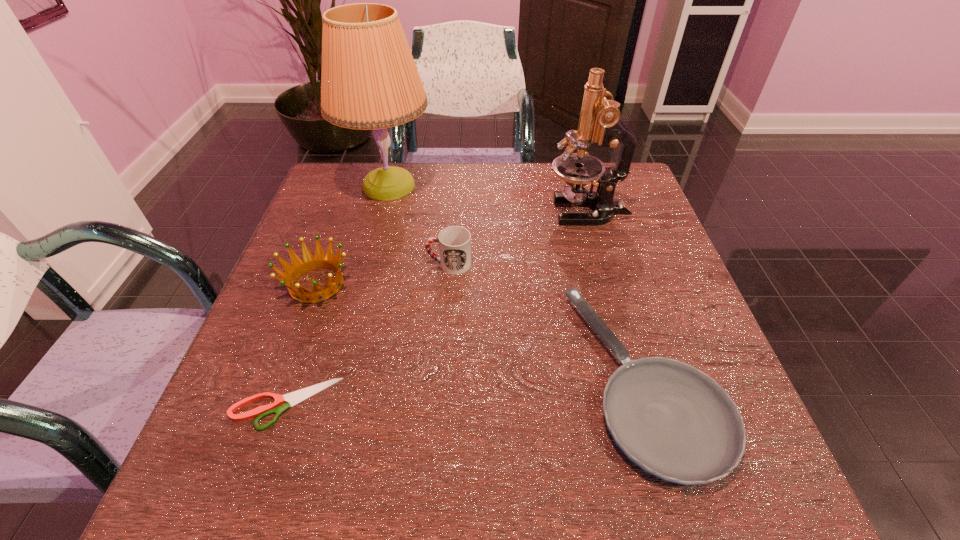
Where is `free spot between the scissors and the cup`? The image size is (960, 540). free spot between the scissors and the cup is located at coordinates (367, 334).

At what (x,y) coordinates should I click in order to perform the action: click on free spot between the lamp and the crown. Please return your answer as a coordinate pair (x, y). This screenshot has height=540, width=960. Looking at the image, I should click on (352, 235).

Find the location of `the closest object relative to the microscope`. the closest object relative to the microscope is located at coordinates (454, 242).

Where is `object that can be found as the closest to the microscope`? This screenshot has height=540, width=960. object that can be found as the closest to the microscope is located at coordinates (454, 242).

Locate an element on the screen. The height and width of the screenshot is (540, 960). blank space that satisfies the following two spatial constraints: 1. at the eyepiece of the second tallest object; 2. on the left side of the second shortest object is located at coordinates (636, 378).

Where is `vacant space that satisfies the following two spatial constraints: 1. on the handle side of the cup; 2. on the side of the lamp near the pull switch`? vacant space that satisfies the following two spatial constraints: 1. on the handle side of the cup; 2. on the side of the lamp near the pull switch is located at coordinates (455, 186).